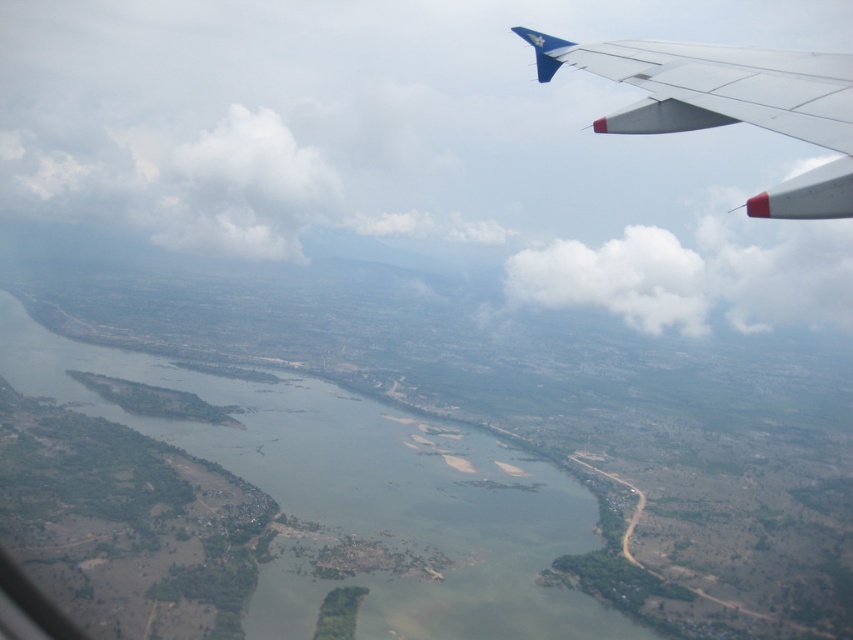
Question: Which object is closer to the camera taking this photo?

Choices:
 (A) green sedimentary river at center
 (B) white matte wing at upper right

Answer: (B)

Question: Can you confirm if white matte wing at upper right is thinner than white fluffy cloud at center?

Choices:
 (A) yes
 (B) no

Answer: (A)

Question: Which point is closer to the camera?

Choices:
 (A) (312, 458)
 (B) (695, 291)

Answer: (A)

Question: Can you confirm if green sedimentary river at center is bigger than white matte wing at upper right?

Choices:
 (A) no
 (B) yes

Answer: (B)

Question: Does green sedimentary river at center appear on the left side of white matte wing at upper right?

Choices:
 (A) yes
 (B) no

Answer: (A)

Question: Which of the following is the closest to the observer?

Choices:
 (A) (561, 269)
 (B) (479, 464)
 (C) (689, 116)

Answer: (C)